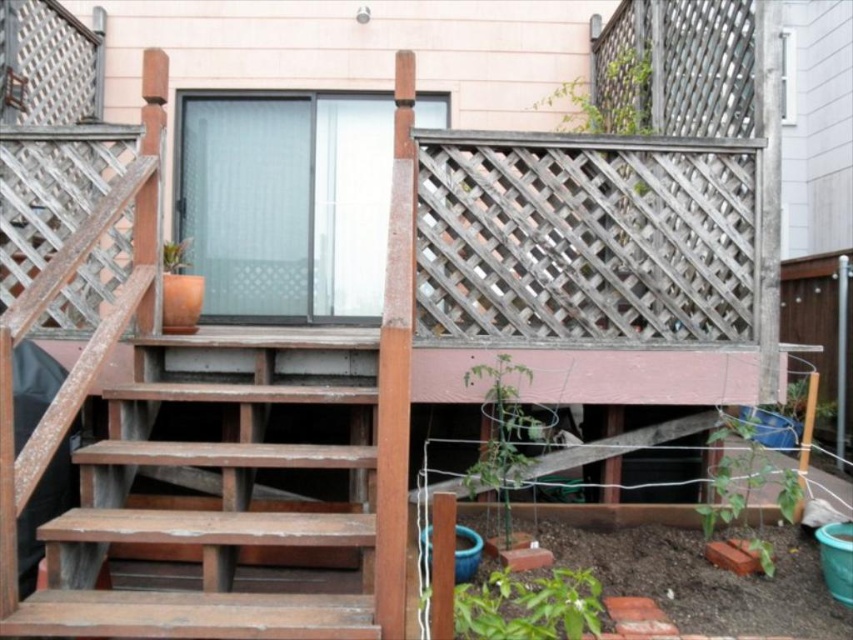
Who is positioned more to the right, green leafy plant at lower center or green leafy plant at lower right?

From the viewer's perspective, green leafy plant at lower right appears more on the right side.

What do you see at coordinates (529, 605) in the screenshot?
I see `green leafy plant at lower center` at bounding box center [529, 605].

What do you see at coordinates (529, 605) in the screenshot? I see `green leafy plant at lower center` at bounding box center [529, 605].

Identify the location of green leafy plant at lower center. This screenshot has height=640, width=853. (529, 605).

Looking at this image, can you confirm if weathered wood stairs at lower left is bigger than green matte plant at center?

Yes, weathered wood stairs at lower left is bigger than green matte plant at center.

Is weathered wood stairs at lower left to the left of green matte plant at center from the viewer's perspective?

Indeed, weathered wood stairs at lower left is positioned on the left side of green matte plant at center.

Find the location of `weathered wood stairs at lower left`. weathered wood stairs at lower left is located at coordinates (222, 499).

Locate an element on the screen. This screenshot has height=640, width=853. weathered wood stairs at lower left is located at coordinates (222, 499).

At what (x,y) coordinates should I click in order to perform the action: click on weathered wood stairs at lower left. Please return your answer as a coordinate pair (x, y). The image size is (853, 640). Looking at the image, I should click on (222, 499).

Which of these two, weathered wood stairs at lower left or green leafy plant at upper center, stands taller?

weathered wood stairs at lower left

The image size is (853, 640). Identify the location of weathered wood stairs at lower left. (222, 499).